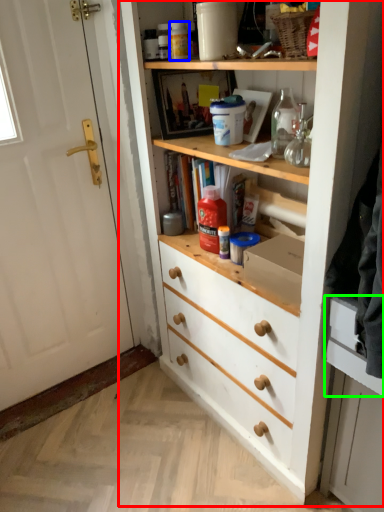
Question: Estimate the real-world distances between objects in this image. Which object is closer to cupboard (highlighted by a red box), bottle (highlighted by a blue box) or drawer (highlighted by a green box)?

Choices:
 (A) bottle
 (B) drawer

Answer: (B)